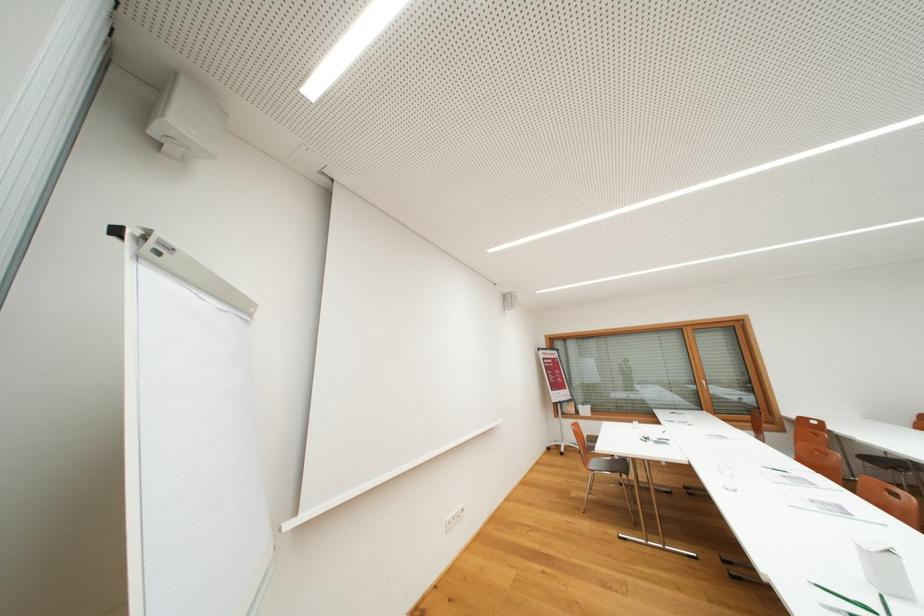
Find the location of a particular element. This screenshot has width=924, height=616. drinking glass is located at coordinates (726, 477).